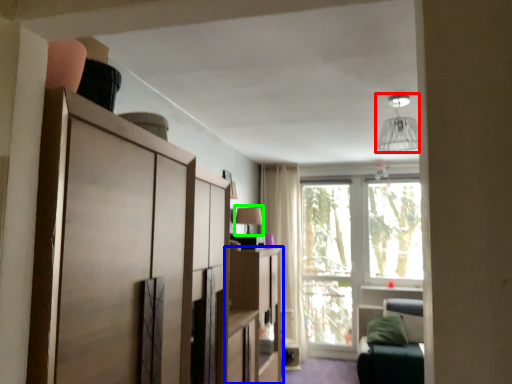
Question: Considering the real-world distances, which object is closest to light fixture (highlighted by a red box)? cabinetry (highlighted by a blue box) or lamp (highlighted by a green box).

Choices:
 (A) cabinetry
 (B) lamp

Answer: (B)